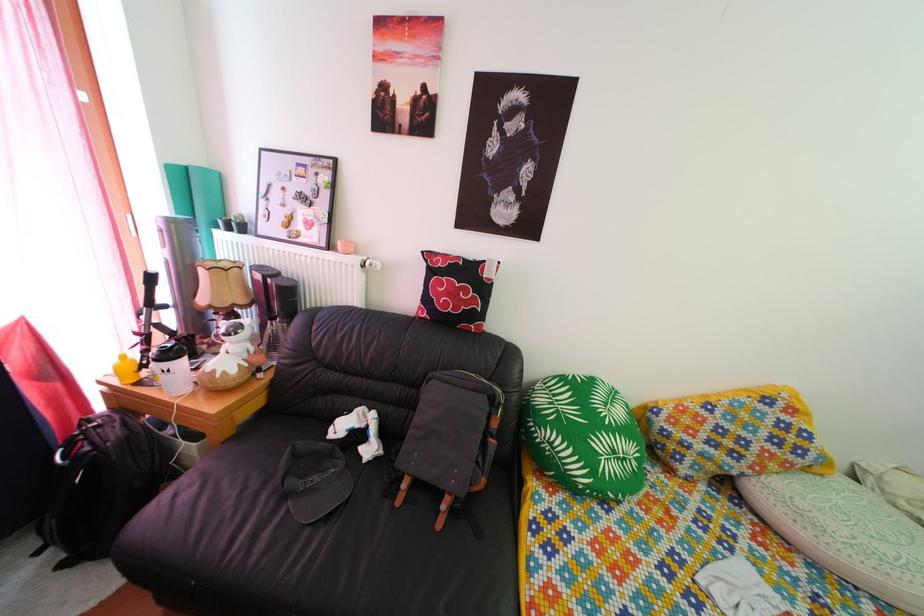
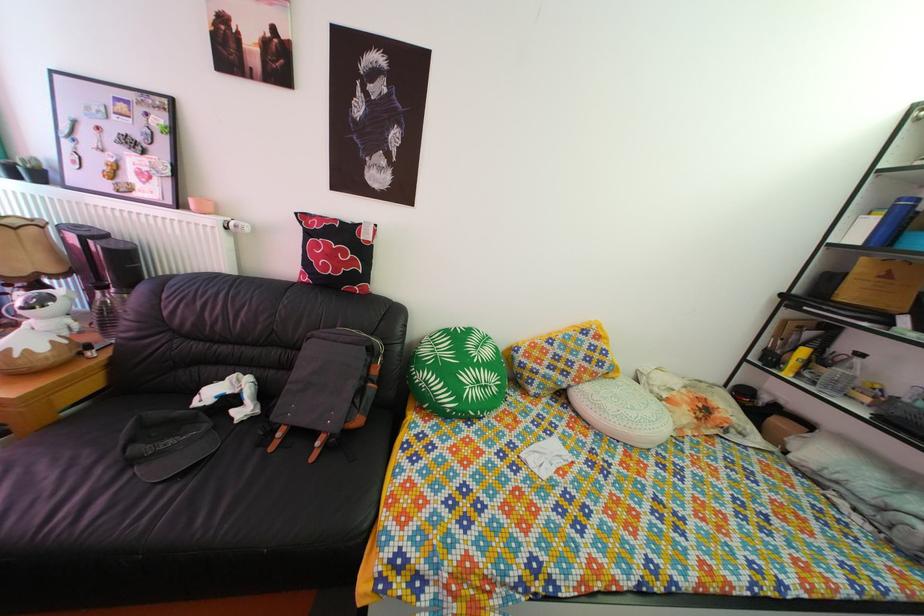
Locate, in the second image, the point that corresponds to [383,270] in the first image.

(249, 232)